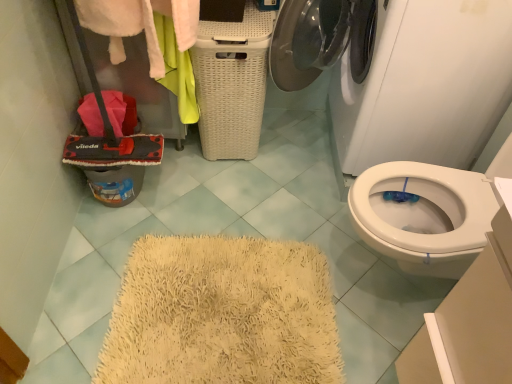
Question: Visually, is white wicker basket at center positioned to the left or to the right of white fluffy towel at upper left?

Choices:
 (A) right
 (B) left

Answer: (A)

Question: From the image's perspective, is white wicker basket at center located above or below white fluffy towel at upper left?

Choices:
 (A) above
 (B) below

Answer: (B)

Question: Based on their relative distances, which object is farther from the white fluffy towel at upper left?

Choices:
 (A) white glossy washing machine at upper center
 (B) white wicker basket at center

Answer: (A)

Question: Considering the real-world distances, which object is farthest from the white fluffy towel at upper left?

Choices:
 (A) white glossy washing machine at upper center
 (B) white wicker basket at center

Answer: (A)